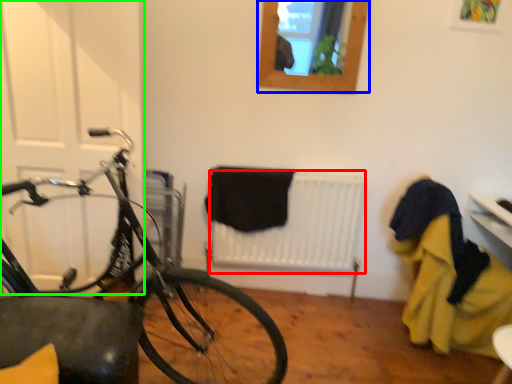
Question: Considering the real-world distances, which object is closest to radiator (highlighted by a red box)? window (highlighted by a blue box) or door (highlighted by a green box).

Choices:
 (A) window
 (B) door

Answer: (A)